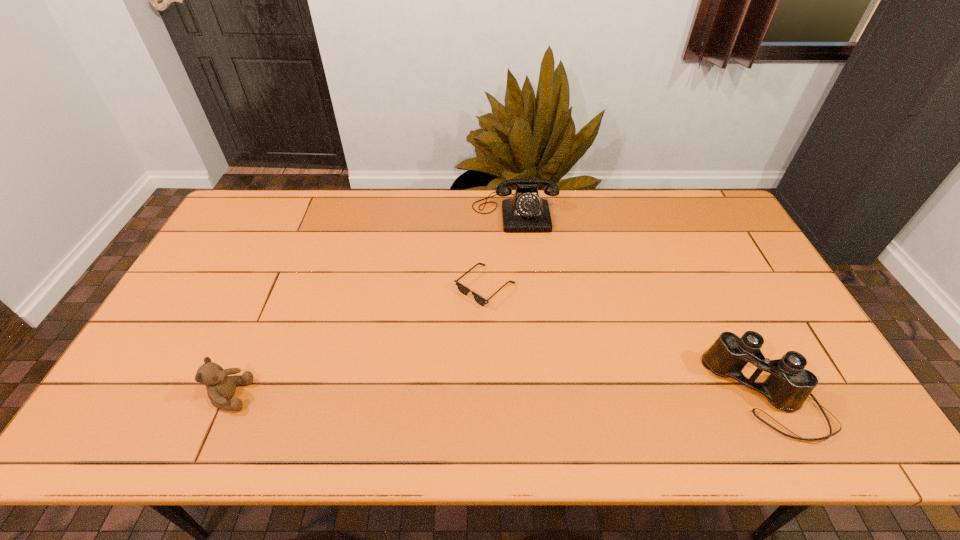
You are a GUI agent. You are given a task and a screenshot of the screen. Output one action in this format:
    pyautogui.click(x=<x>, y=<y>)
    Task: Click on the leftmost object
    
    Given the screenshot: What is the action you would take?
    [220, 387]

Where is `the rightmost object`? This screenshot has width=960, height=540. the rightmost object is located at coordinates (788, 386).

Where is `sunglasses`? The height and width of the screenshot is (540, 960). sunglasses is located at coordinates (464, 290).

You are a GUI agent. You are given a task and a screenshot of the screen. Output one action in this format:
    pyautogui.click(x=<x>, y=<y>)
    Task: Click on the third nearest object
    The image size is (960, 540).
    Given the screenshot: What is the action you would take?
    pyautogui.click(x=464, y=290)

What are the coordinates of `telephone` in the screenshot? It's located at (525, 212).

Identify the location of vacant point located 0.070m on the front-facing side of the leftmost object. (278, 395).

Image resolution: width=960 pixels, height=540 pixels. Find the location of `vacant space located 0.260m on the back of the binoculars`. vacant space located 0.260m on the back of the binoculars is located at coordinates (710, 282).

Find the location of a particular element. vacant area situated on the lenses of the shortest object is located at coordinates (470, 335).

Identify the location of free spot located on the lenses of the shortest object. (458, 376).

Image resolution: width=960 pixels, height=540 pixels. I want to click on vacant space located 0.130m on the lenses of the shortest object, so click(467, 347).